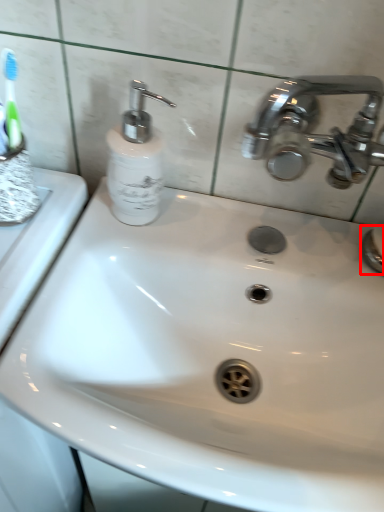
Question: Considering the relative positions of plumbing fixture (annotated by the red box) and soap dispenser in the image provided, where is plumbing fixture (annotated by the red box) located with respect to the staircase?

Choices:
 (A) left
 (B) right

Answer: (B)